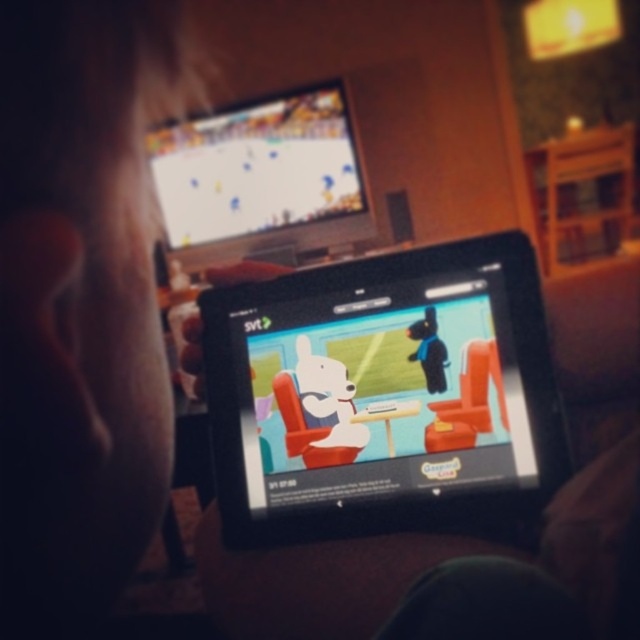
Is black glossy tablet at center closer to camera compared to matte plastic tv at upper center?

Yes, it is.

Who is positioned more to the right, black glossy tablet at center or matte plastic tv at upper center?

black glossy tablet at center is more to the right.

This screenshot has width=640, height=640. Find the location of `black glossy tablet at center`. black glossy tablet at center is located at coordinates (385, 396).